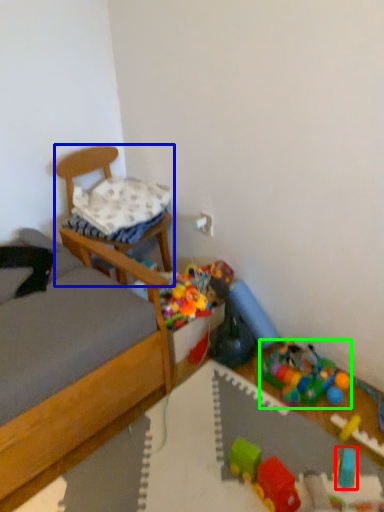
Question: Estimate the real-world distances between objects in this image. Which object is closer to toy (highlighted by a red box), chair (highlighted by a blue box) or toy (highlighted by a green box)?

Choices:
 (A) chair
 (B) toy

Answer: (B)